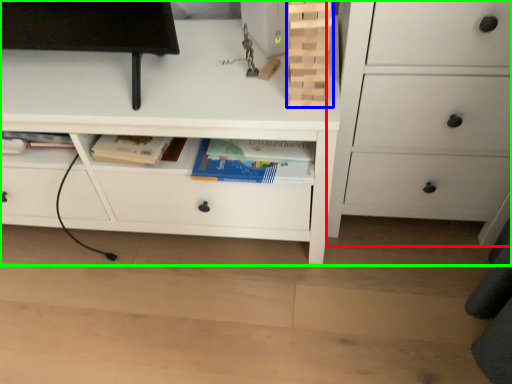
Question: Which is nearer to the chest of drawers (highlighted by a red box)? book (highlighted by a blue box) or chest of drawers (highlighted by a green box).

Choices:
 (A) book
 (B) chest of drawers

Answer: (B)